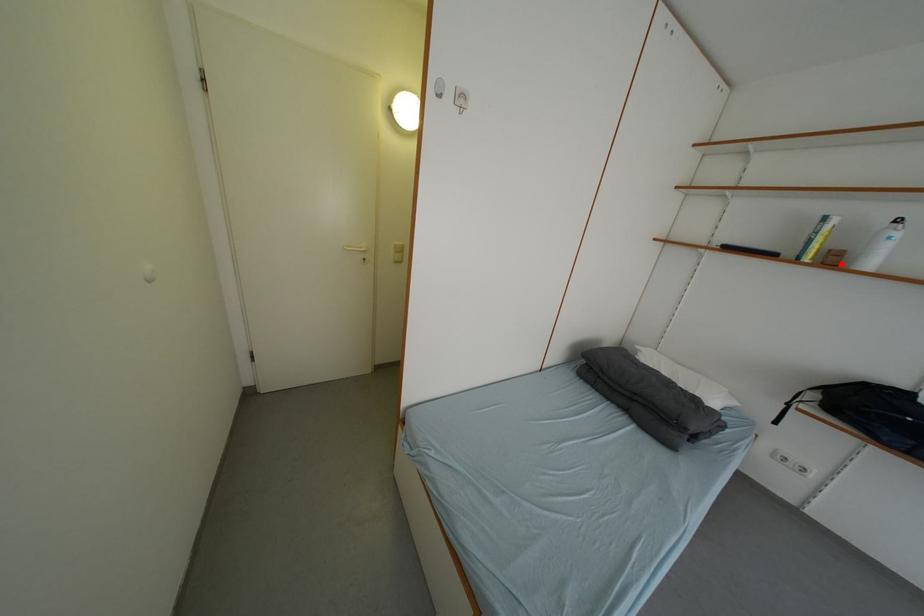
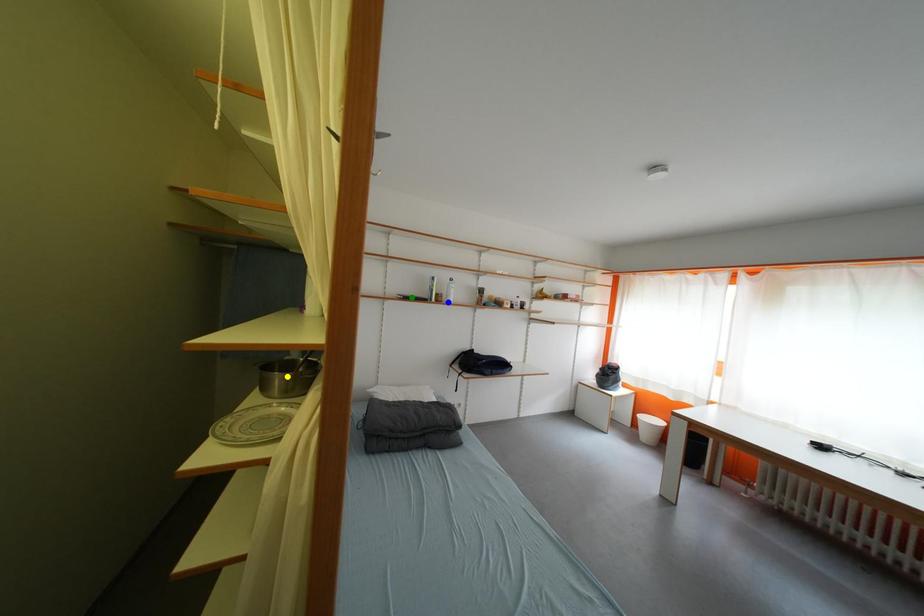
Question: I am providing you with two images of the same scene from different viewpoints. A red point is marked on the first image. You are given multiple points on the second image. In image 2, which mark is for the same physical point as the one in image 1?

Choices:
 (A) green point
 (B) yellow point
 (C) blue point

Answer: (C)